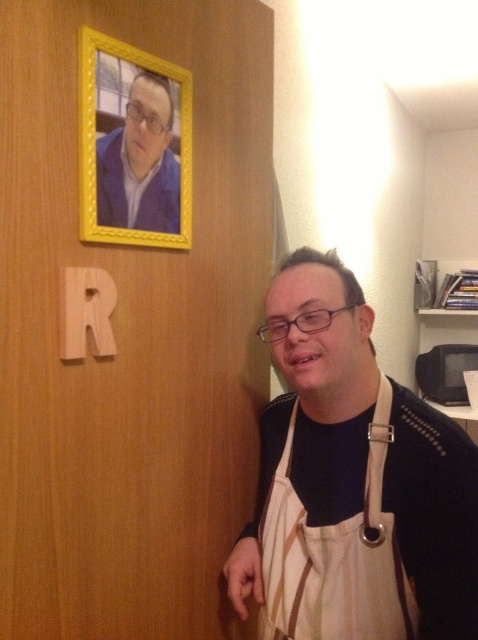
You are trying to decide whether to hang a new decorative item on the wall next to the yellow wood picture frame at upper left. Considering the size of the beige apron at right, which is larger, would it be appropriate to place the new item near the frame?

The beige apron at right is larger than the yellow wood picture frame at upper left. Since the new item is being compared to the apron, it might be too large for the space near the frame. Consider choosing a smaller item instead.

You are organizing a kitchen and need to choose an apron that can fit more cooking tools. Which apron between the beige apron at right and the beige canvas apron at lower right would you select?

The beige apron at right has a larger width than the beige canvas apron at lower right, so it can hold more cooking tools.